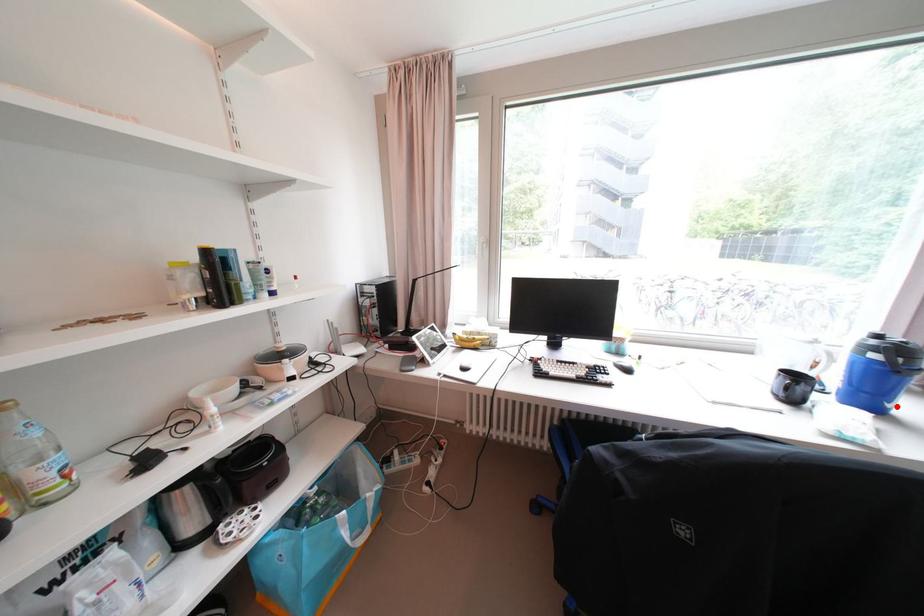
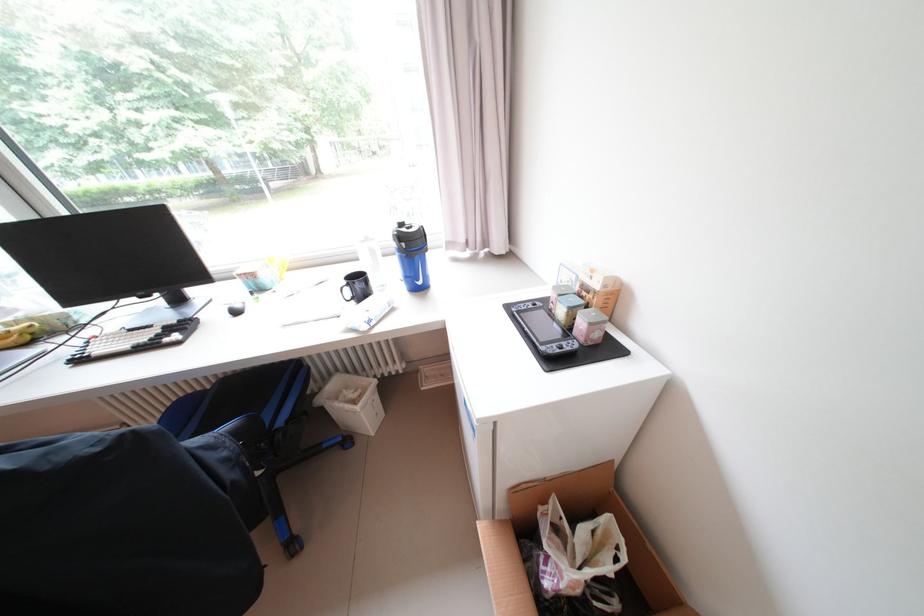
The point at the highlighted location is marked in the first image. Where is the corresponding point in the second image?

(428, 284)